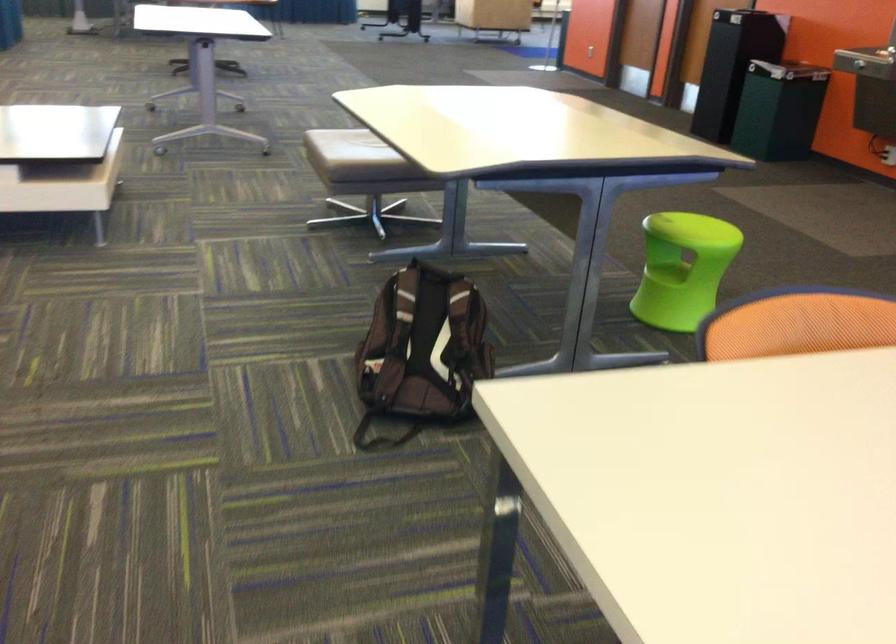
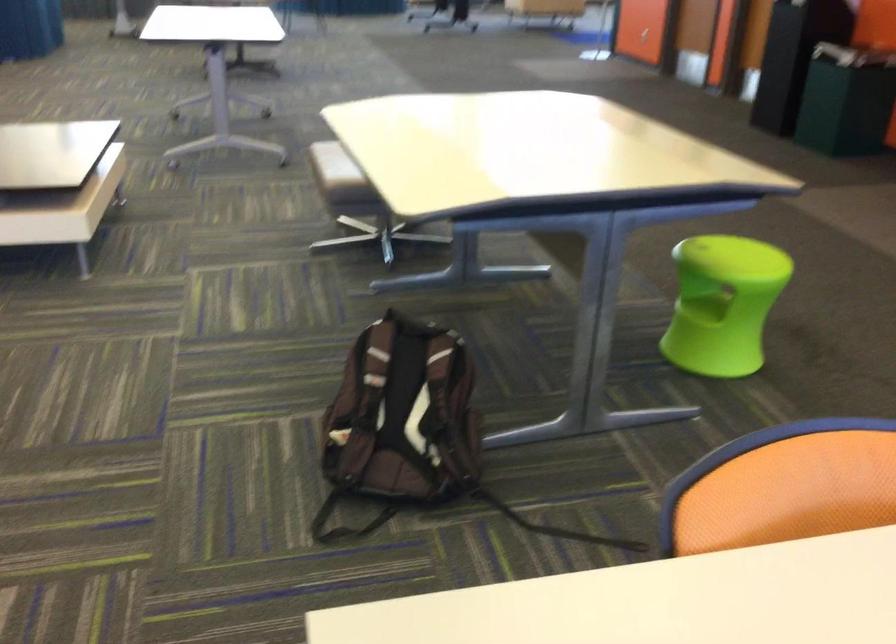
Where in the second image is the point corresponding to pixel 432 346 from the first image?

(402, 413)